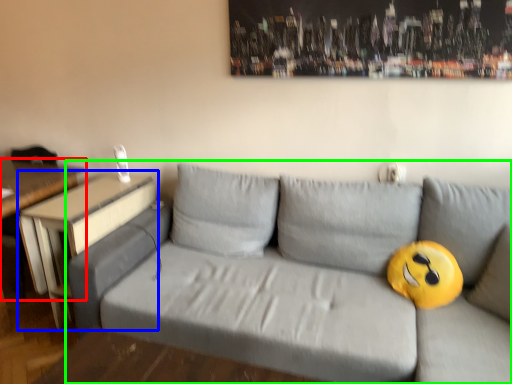
Question: Based on their relative distances, which object is farther from table (highlighted by a red box)? Choose from table (highlighted by a blue box) and studio couch (highlighted by a green box).

Choices:
 (A) table
 (B) studio couch

Answer: (B)